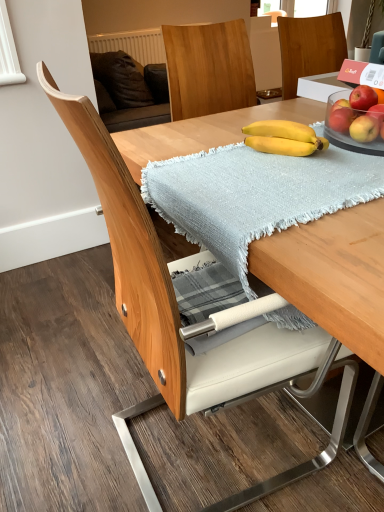
Find the location of `red matte apple at upper right, arranged as the first apple when viewed from the top`. red matte apple at upper right, arranged as the first apple when viewed from the top is located at coordinates click(x=363, y=97).

This screenshot has height=512, width=384. In order to click on red matte apple at upper right, the 3th apple ordered from the bottom in this screenshot , I will do `click(377, 111)`.

What is the approximate width of red matte apple at upper right, the second apple from the top?

1.91 inches.

The width and height of the screenshot is (384, 512). I want to click on matte yellow apple at right, which ranks as the 1th apple in bottom-to-top order, so click(365, 128).

From the image's perspective, which one is positioned lower, red matte apple at upper right, which is the 4th apple in bottom-to-top order, or wooden chair at center?

From the image's view, wooden chair at center is below.

In the image, is red matte apple at upper right, arranged as the first apple when viewed from the top, positioned in front of or behind wooden chair at center?

Clearly, red matte apple at upper right, arranged as the first apple when viewed from the top, is behind wooden chair at center.

Is red matte apple at upper right, arranged as the first apple when viewed from the top, next to wooden chair at center and touching it?

There is a gap between red matte apple at upper right, arranged as the first apple when viewed from the top, and wooden chair at center.

Is point (375, 102) closer or farther from the camera than point (123, 220)?

Point (375, 102) appears to be farther away from the viewer than point (123, 220).

From the picture: Is light blue woven blanket at center directly adjacent to matte yellow apple at right, the fourth apple viewed from the top?

light blue woven blanket at center is not next to matte yellow apple at right, the fourth apple viewed from the top, and they're not touching.

Is light blue woven blanket at center positioned behind matte yellow apple at right, the fourth apple viewed from the top?

No, light blue woven blanket at center is in front of matte yellow apple at right, the fourth apple viewed from the top.

Which of these two, light blue woven blanket at center or matte yellow apple at right, which ranks as the 1th apple in bottom-to-top order, is bigger?

Bigger between the two is light blue woven blanket at center.

Can you tell me how much light blue woven blanket at center and matte yellow apple at right, which ranks as the 1th apple in bottom-to-top order, differ in facing direction?

178 degrees.

Is light blue woven blanket at center positioned with its back to wooden chair at center?

Yes, light blue woven blanket at center is positioned with its back facing wooden chair at center.

From the image's perspective, which is above, light blue woven blanket at center or wooden chair at center?

light blue woven blanket at center, from the image's perspective.

Can you tell me how much light blue woven blanket at center and wooden chair at center differ in facing direction?

The angular difference between light blue woven blanket at center and wooden chair at center is 0.779 degrees.

Considering the relative positions of matte yellow apple at right, the fourth apple viewed from the top, and yellow matte bananas at center in the image provided, is matte yellow apple at right, the fourth apple viewed from the top, to the left of yellow matte bananas at center from the viewer's perspective?

Incorrect, matte yellow apple at right, the fourth apple viewed from the top, is not on the left side of yellow matte bananas at center.

What's the angular difference between matte yellow apple at right, the fourth apple viewed from the top, and yellow matte bananas at center's facing directions?

32.2 degrees.

Are matte yellow apple at right, which ranks as the 1th apple in bottom-to-top order, and yellow matte bananas at center making contact?

No.

Based on their sizes in the image, would you say matte yellow apple at right, which ranks as the 1th apple in bottom-to-top order, is bigger or smaller than yellow matte bananas at center?

Clearly, matte yellow apple at right, which ranks as the 1th apple in bottom-to-top order, is smaller in size than yellow matte bananas at center.

Is wooden chair at center closer to the viewer compared to light blue woven blanket at center?

That is True.

Considering the sizes of objects wooden chair at center and light blue woven blanket at center in the image provided, who is shorter, wooden chair at center or light blue woven blanket at center?

light blue woven blanket at center is shorter.

Locate an element on the screen. The width and height of the screenshot is (384, 512). chair on the left of the light blue woven blanket at center is located at coordinates (164, 290).

From the image's perspective, between light blue woven blanket at center and red matte apple at upper right, arranged as the first apple when viewed from the top, who is located below?

From the image's view, light blue woven blanket at center is below.

Based on the photo, is light blue woven blanket at center positioned beyond the bounds of red matte apple at upper right, which is the 4th apple in bottom-to-top order?

Answer: Absolutely, light blue woven blanket at center is external to red matte apple at upper right, which is the 4th apple in bottom-to-top order.

Identify the location of blanket in front of the red matte apple at upper right, which is the 4th apple in bottom-to-top order. This screenshot has height=512, width=384. (255, 195).

Based on the photo, what's the angular difference between light blue woven blanket at center and red matte apple at upper right, which is the 4th apple in bottom-to-top order,'s facing directions?

The angle between the facing direction of light blue woven blanket at center and the facing direction of red matte apple at upper right, which is the 4th apple in bottom-to-top order, is 175 degrees.

From a real-world perspective, between red matte apple at upper right, the 3th apple ordered from the bottom, and yellow matte bananas at center, who is vertically lower?

yellow matte bananas at center.

Is red matte apple at upper right, the second apple from the top, facing towards yellow matte bananas at center?

Yes.

In terms of height, does red matte apple at upper right, the second apple from the top, look taller or shorter compared to yellow matte bananas at center?

Considering their sizes, red matte apple at upper right, the second apple from the top, has less height than yellow matte bananas at center.

Locate an element on the screen. The image size is (384, 512). the 4th apple positioned above the wooden chair at center (from a real-world perspective) is located at coordinates (363, 97).

At what (x,y) coordinates should I click in order to perform the action: click on blanket on the left of matte yellow apple at right, the fourth apple viewed from the top. Please return your answer as a coordinate pair (x, y). The height and width of the screenshot is (512, 384). Looking at the image, I should click on (255, 195).

From the image, which object appears to be farther from light blue woven blanket at center, matte yellow apple at right, which ranks as the 1th apple in bottom-to-top order, or yellow matte bananas at center?

Based on the image, matte yellow apple at right, which ranks as the 1th apple in bottom-to-top order, appears to be further to light blue woven blanket at center.

In the scene shown: Which object lies further to the anchor point yellow matte bananas at center, wooden chair at center or light blue woven blanket at center?

Among the two, wooden chair at center is located further to yellow matte bananas at center.

Considering their positions, is light blue woven blanket at center positioned further to red matte apple at upper right, arranged as the first apple when viewed from the top, than red matte apple at upper right, acting as the second apple starting from the bottom?

light blue woven blanket at center lies further to red matte apple at upper right, arranged as the first apple when viewed from the top, than the other object.

Considering their positions, is light blue woven blanket at center positioned further to yellow matte bananas at center than wooden chair at center?

wooden chair at center.

From the image, which object appears to be farther from wooden chair at center, red matte apple at upper right, acting as the second apple starting from the bottom, or matte yellow apple at right, the fourth apple viewed from the top?

The object further to wooden chair at center is red matte apple at upper right, acting as the second apple starting from the bottom.

From the picture: When comparing their distances from red matte apple at upper right, which is the 4th apple in bottom-to-top order, does wooden chair at center or light blue woven blanket at center seem closer?

light blue woven blanket at center lies closer to red matte apple at upper right, which is the 4th apple in bottom-to-top order, than the other object.

Estimate the real-world distances between objects in this image. Which object is closer to light blue woven blanket at center, red matte apple at upper right, the 3th apple ordered from the bottom, or yellow matte bananas at center?

yellow matte bananas at center is closer to light blue woven blanket at center.

Looking at the image, which one is located closer to red matte apple at upper right, the 3th apple ordered from the bottom, matte yellow apple at right, which ranks as the 1th apple in bottom-to-top order, or yellow matte bananas at center?

matte yellow apple at right, which ranks as the 1th apple in bottom-to-top order, lies closer to red matte apple at upper right, the 3th apple ordered from the bottom, than the other object.

I want to click on blanket located between wooden chair at center and matte yellow apple at right, the fourth apple viewed from the top, in the depth direction, so click(255, 195).

You are a GUI agent. You are given a task and a screenshot of the screen. Output one action in this format:
    pyautogui.click(x=<x>, y=<y>)
    Task: Click on the apple between yellow matte bananas at center and matte yellow apple at right, the fourth apple viewed from the top, from left to right
    
    Given the screenshot: What is the action you would take?
    pyautogui.click(x=341, y=118)

The width and height of the screenshot is (384, 512). Find the location of `banana positioned between light blue woven blanket at center and red matte apple at upper right, acting as the second apple starting from the bottom, from near to far`. banana positioned between light blue woven blanket at center and red matte apple at upper right, acting as the second apple starting from the bottom, from near to far is located at coordinates (283, 138).

What are the coordinates of `blanket located between wooden chair at center and red matte apple at upper right, which is the 4th apple in bottom-to-top order, in the depth direction` in the screenshot? It's located at (255, 195).